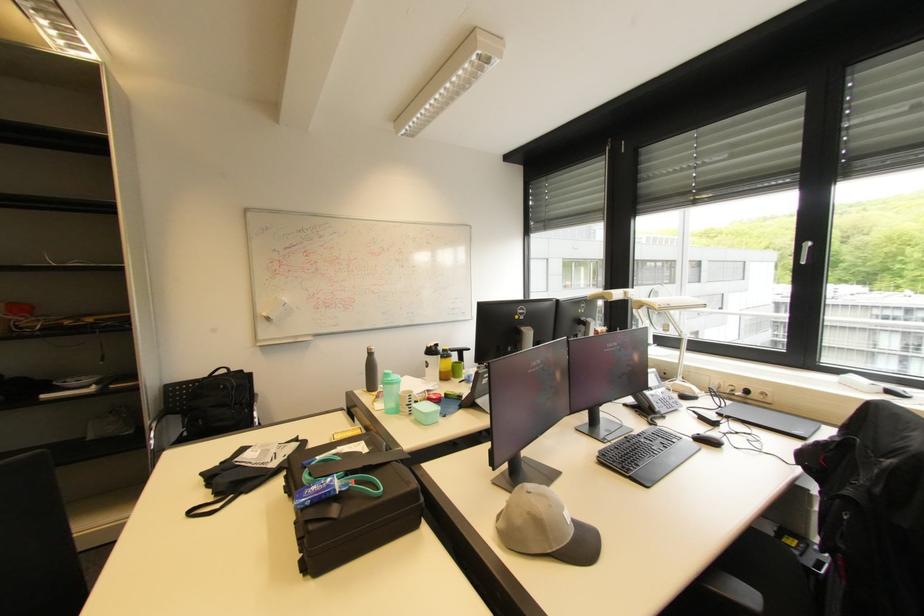
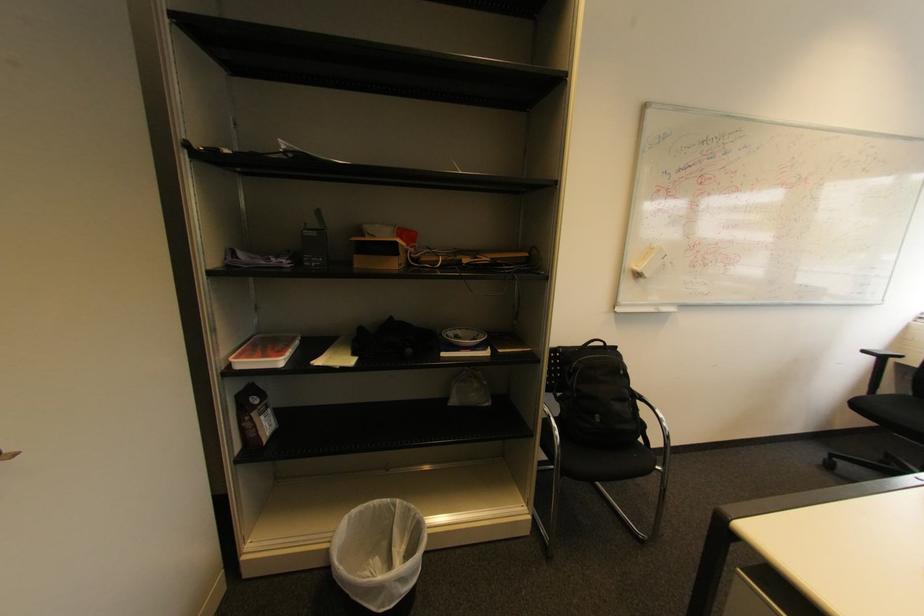
Question: I am providing you with two images of the same scene from different viewpoints. Which of the following objects are not visible in image2?

Choices:
 (A) white trash can
 (B) black chair armrest
 (C) small cardboard box
 (D) none of these

Answer: (D)